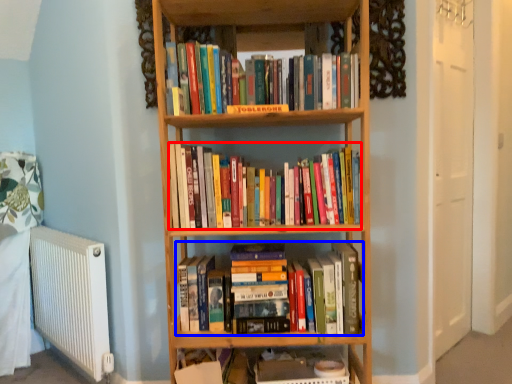
Question: Among these objects, which one is nearest to the camera, book (highlighted by a red box) or book (highlighted by a blue box)?

Choices:
 (A) book
 (B) book

Answer: (A)